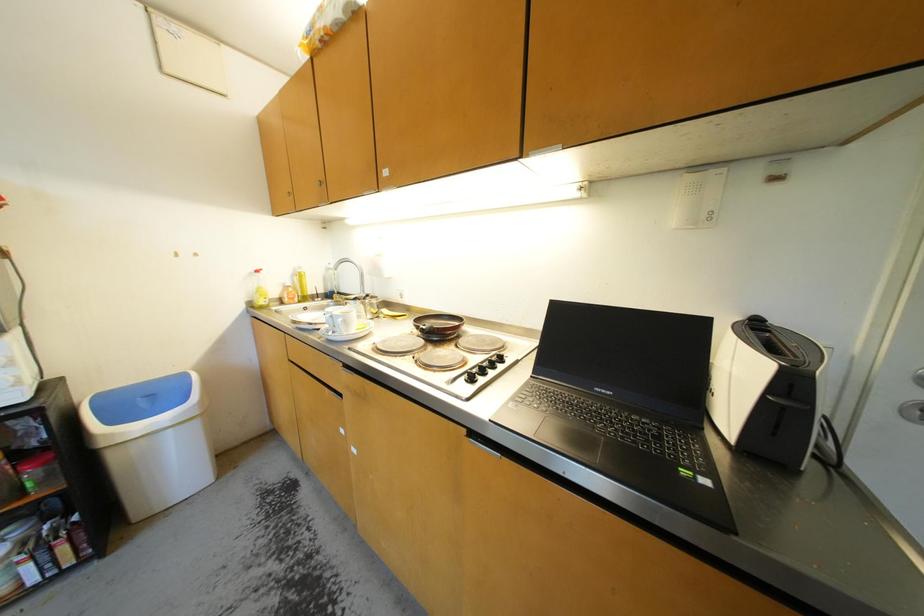
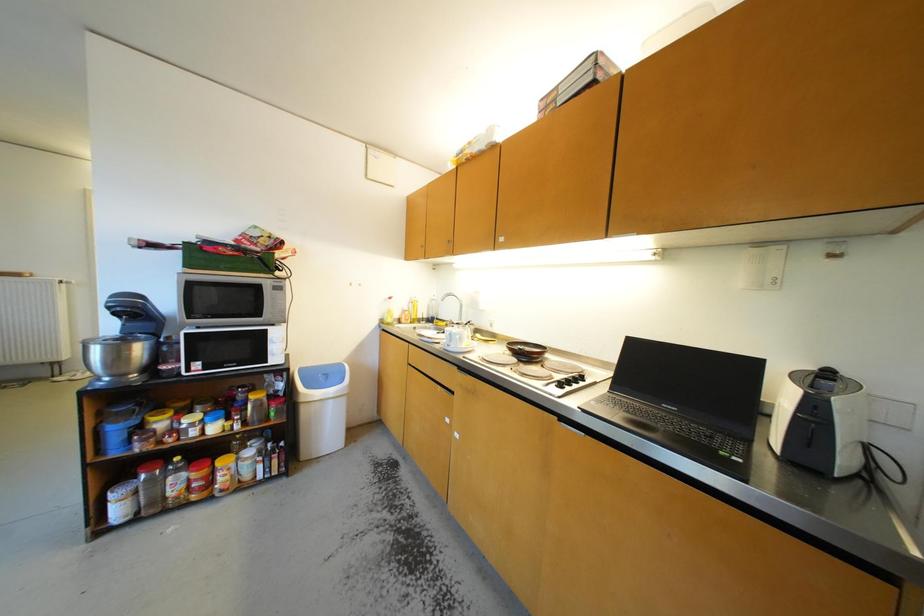
Question: Based on the continuous images, in which direction is the camera rotating? Reply with the corresponding letter.

Choices:
 (A) Left
 (B) Right
 (C) Up
 (D) Down

Answer: (A)